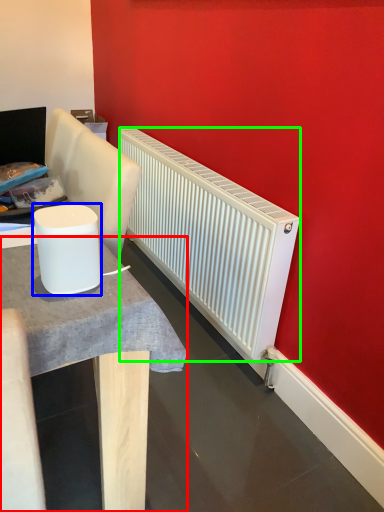
Question: Considering the real-world distances, which object is farthest from table (highlighted by a red box)? appliance (highlighted by a blue box) or radiator (highlighted by a green box)?

Choices:
 (A) appliance
 (B) radiator

Answer: (B)